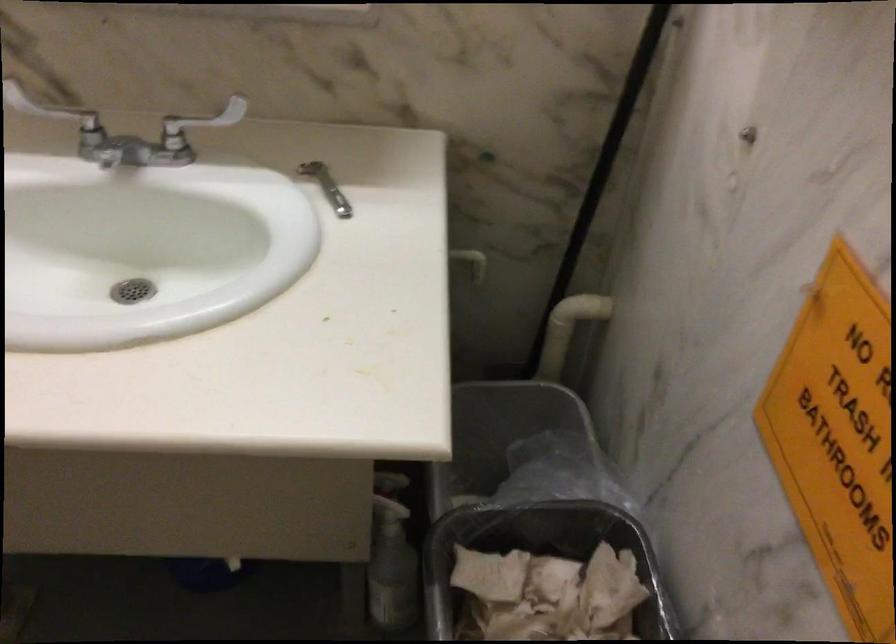
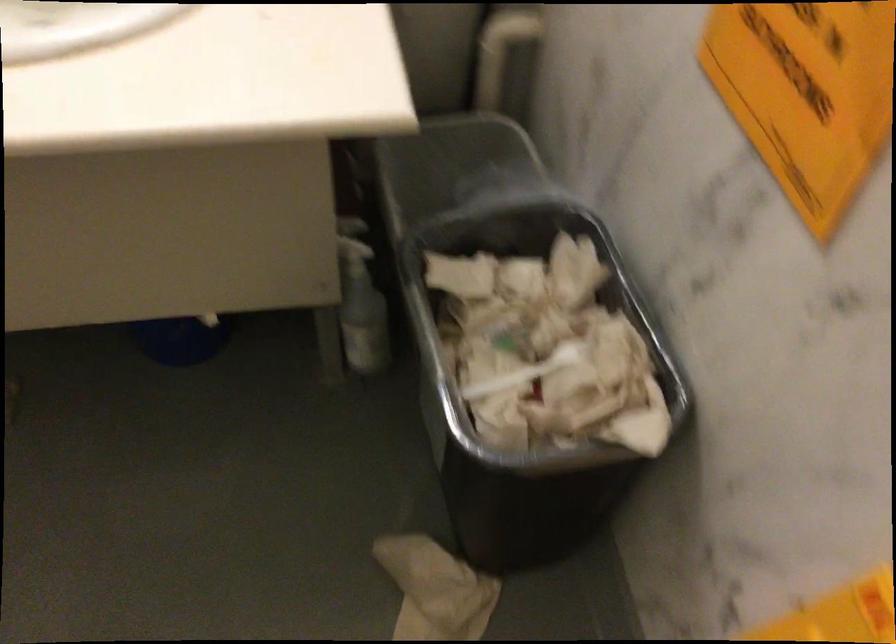
Locate, in the second image, the point that corresponds to (389,563) in the first image.

(360, 303)